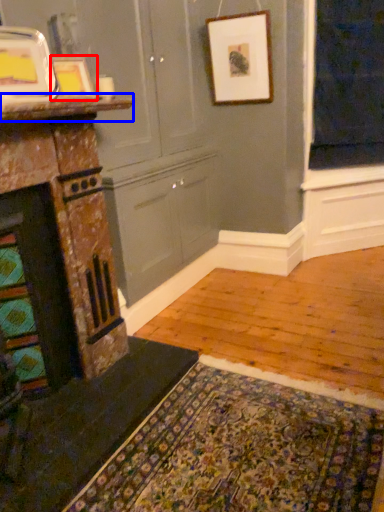
Question: Among these objects, which one is farthest to the camera, picture frame (highlighted by a red box) or counter top (highlighted by a blue box)?

Choices:
 (A) picture frame
 (B) counter top

Answer: (A)